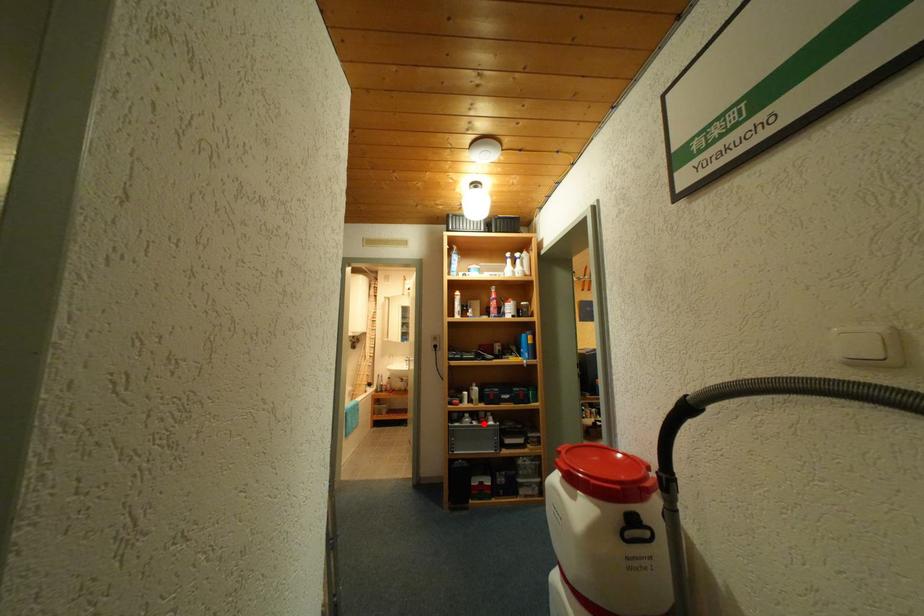
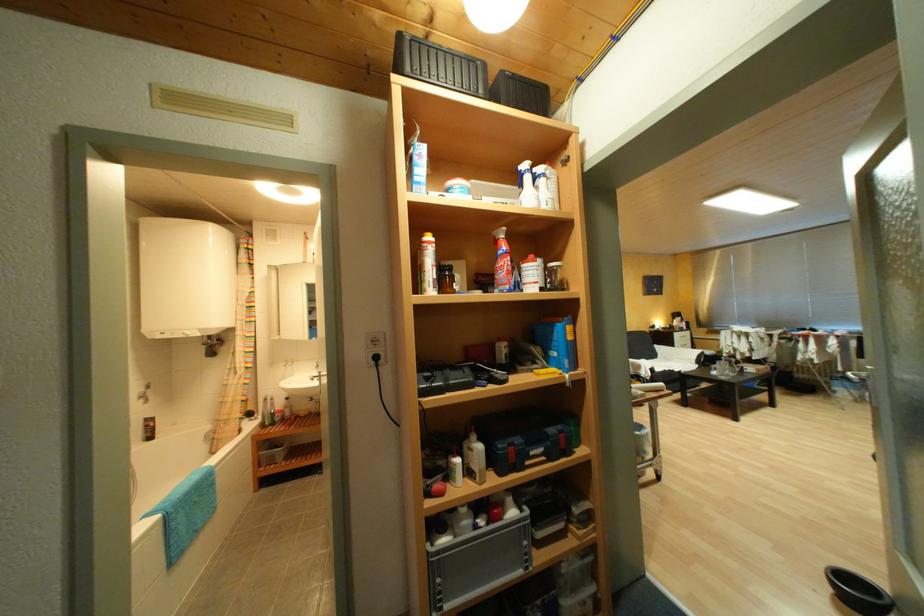
Question: I am providing you with two images of the same scene from different viewpoints. A red point is marked on the first image. At the location where the point appears in image 1, is it still visible in image 2?

Choices:
 (A) Yes
 (B) No

Answer: (A)